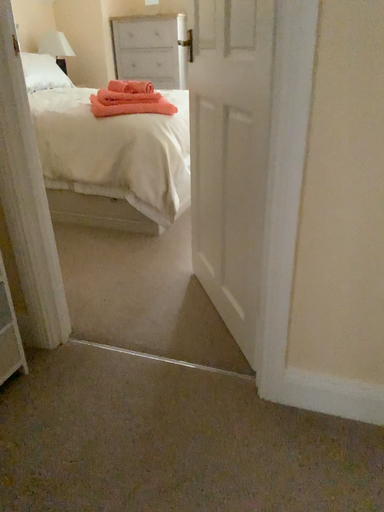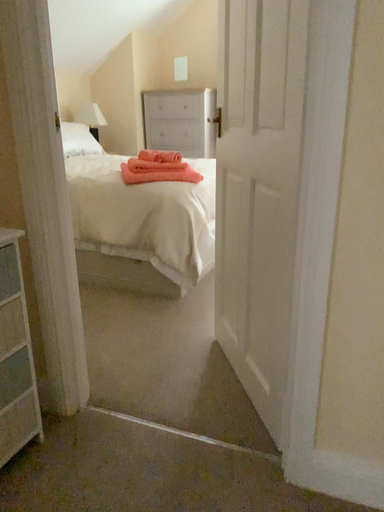
Question: Which way did the camera rotate in the video?

Choices:
 (A) rotated upward
 (B) rotated downward

Answer: (A)